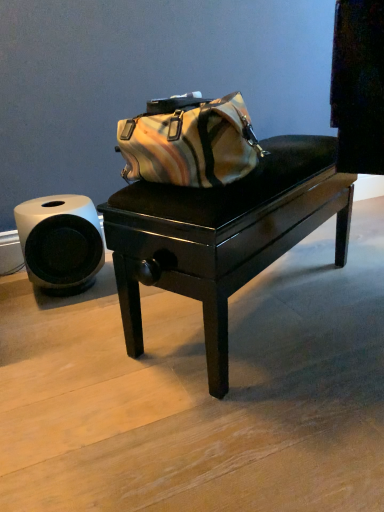
This screenshot has height=512, width=384. Find the location of `vacant point to the left of glossy black table at center`. vacant point to the left of glossy black table at center is located at coordinates (87, 335).